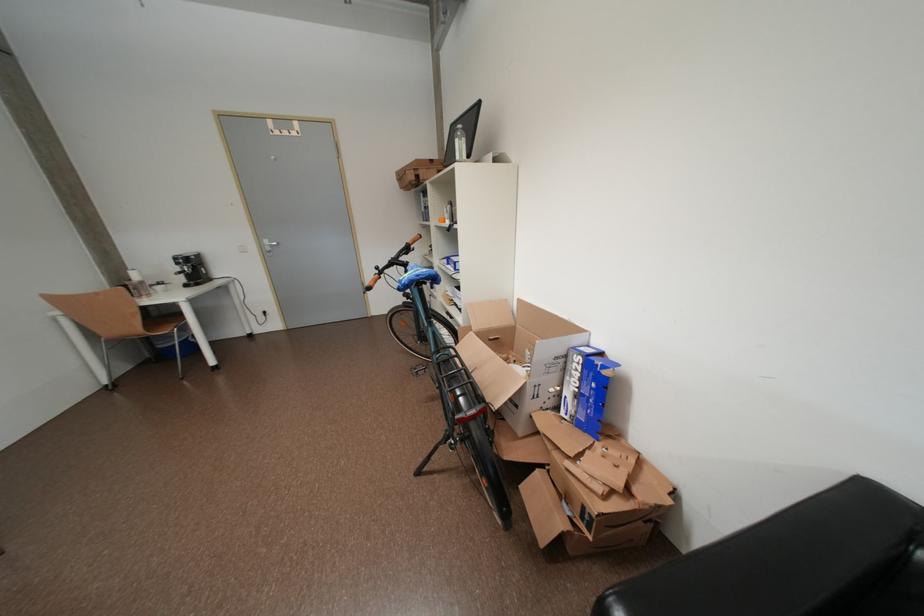
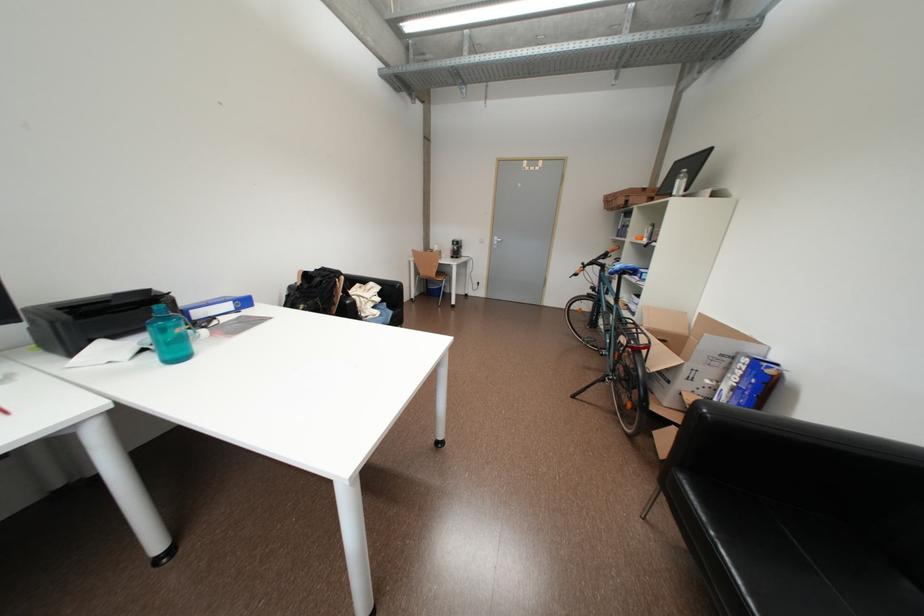
In the second image, find the point that corresponds to the point at 416,252 in the first image.

(613, 257)